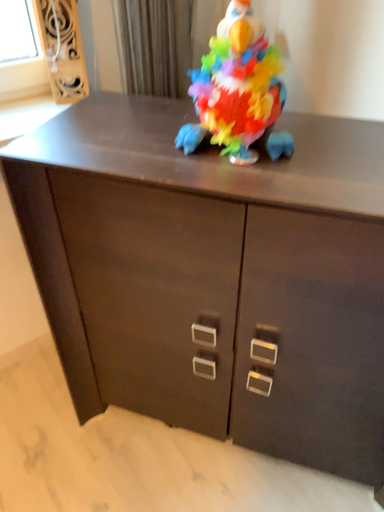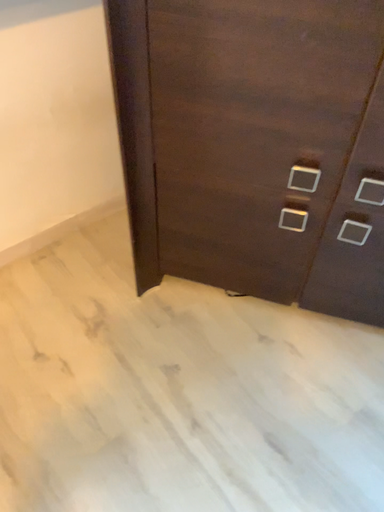
Question: How did the camera likely rotate when shooting the video?

Choices:
 (A) rotated downward
 (B) rotated upward

Answer: (A)